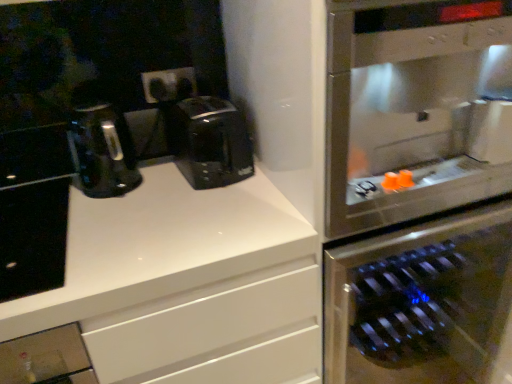
Question: Does black matte cabinet at left have a greater width compared to stainless steel wine cooler at right?

Choices:
 (A) no
 (B) yes

Answer: (A)

Question: From a real-world perspective, is black matte cabinet at left located beneath stainless steel wine cooler at right?

Choices:
 (A) yes
 (B) no

Answer: (B)

Question: Is black matte cabinet at left positioned far away from stainless steel wine cooler at right?

Choices:
 (A) no
 (B) yes

Answer: (A)

Question: Is the surface of black matte cabinet at left in direct contact with stainless steel wine cooler at right?

Choices:
 (A) yes
 (B) no

Answer: (B)

Question: Can you confirm if black matte cabinet at left is bigger than stainless steel wine cooler at right?

Choices:
 (A) no
 (B) yes

Answer: (A)

Question: Is black matte cabinet at left outside stainless steel wine cooler at right?

Choices:
 (A) no
 (B) yes

Answer: (B)

Question: Is black plastic coffee maker at center wider than stainless steel wine cooler at right?

Choices:
 (A) no
 (B) yes

Answer: (A)

Question: Is black plastic coffee maker at center behind stainless steel wine cooler at right?

Choices:
 (A) no
 (B) yes

Answer: (B)

Question: From the image's perspective, does black plastic coffee maker at center appear lower than stainless steel wine cooler at right?

Choices:
 (A) yes
 (B) no

Answer: (B)

Question: Does black plastic coffee maker at center have a lesser width compared to stainless steel wine cooler at right?

Choices:
 (A) no
 (B) yes

Answer: (B)

Question: Is black plastic coffee maker at center taller than stainless steel wine cooler at right?

Choices:
 (A) yes
 (B) no

Answer: (B)

Question: Is black plastic coffee maker at center closer to camera compared to stainless steel wine cooler at right?

Choices:
 (A) no
 (B) yes

Answer: (A)

Question: Is stainless steel oven at right taller than stainless steel wine cooler at right?

Choices:
 (A) no
 (B) yes

Answer: (A)